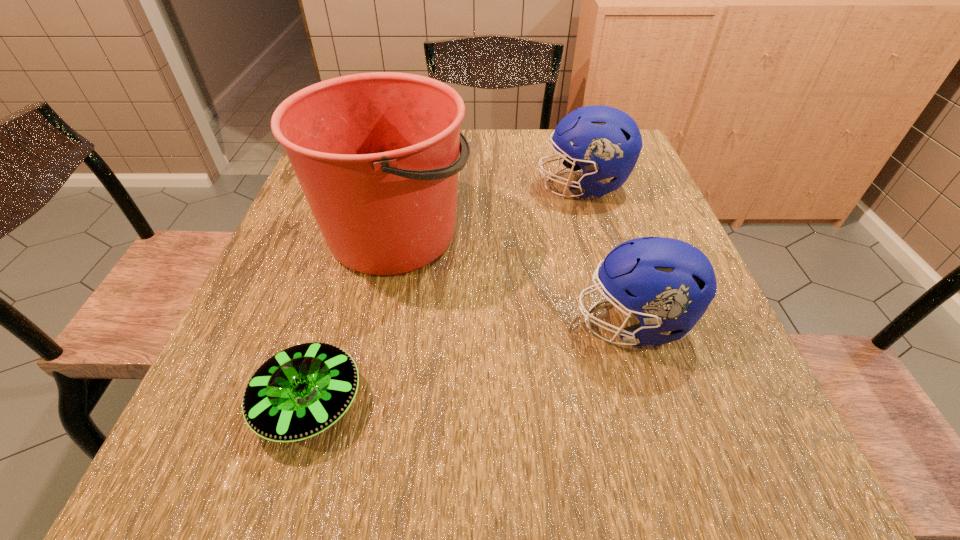
In the image, there is a desktop. At what (x,y) coordinates should I click in order to perform the action: click on vacant space at the right edge. Please return your answer as a coordinate pair (x, y). The width and height of the screenshot is (960, 540). Looking at the image, I should click on (677, 341).

Where is `free spot at the far right corner of the desktop`? Image resolution: width=960 pixels, height=540 pixels. free spot at the far right corner of the desktop is located at coordinates (638, 166).

This screenshot has width=960, height=540. Identify the location of free space between the bucket and the saucer. coord(351,318).

This screenshot has width=960, height=540. I want to click on vacant space in between the nearer football helmet and the farther football helmet, so click(x=608, y=254).

The height and width of the screenshot is (540, 960). In order to click on free point between the nearer football helmet and the farther football helmet in this screenshot , I will do `click(608, 254)`.

Find the location of `free area in between the tallest object and the farther football helmet`. free area in between the tallest object and the farther football helmet is located at coordinates (489, 209).

In order to click on blank region between the shortest object and the tallest object in this screenshot , I will do [351, 318].

You are a GUI agent. You are given a task and a screenshot of the screen. Output one action in this format:
    pyautogui.click(x=<x>, y=<y>)
    Task: Click on the vacant space that is in between the tallest object and the saucer
    
    Given the screenshot: What is the action you would take?
    pyautogui.click(x=351, y=318)

You are a GUI agent. You are given a task and a screenshot of the screen. Output one action in this format:
    pyautogui.click(x=<x>, y=<y>)
    Task: Click on the free area in between the shortest object and the nearer football helmet
    This screenshot has height=540, width=960.
    Given the screenshot: What is the action you would take?
    pyautogui.click(x=471, y=362)

The image size is (960, 540). What are the coordinates of `vacant space that's between the farther football helmet and the bucket` in the screenshot? It's located at (489, 209).